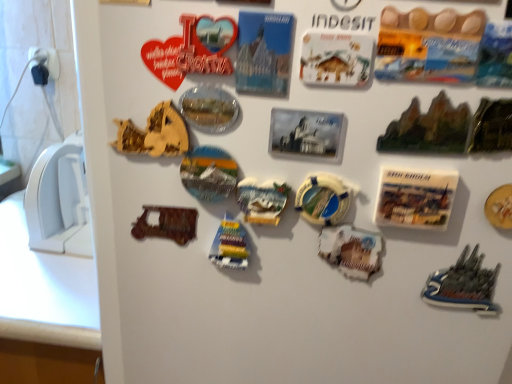
Question: Considering the positions of white paper postcard at center right and wooden toy boat at center, marked as the 2th stuff in a left-to-right arrangement, in the image, is white paper postcard at center right taller or shorter than wooden toy boat at center, marked as the 2th stuff in a left-to-right arrangement,?

Choices:
 (A) short
 (B) tall

Answer: (A)

Question: In the image, is white paper postcard at center right on the left side or the right side of wooden toy boat at center, marked as the 6th stuff in a right-to-left arrangement?

Choices:
 (A) right
 (B) left

Answer: (A)

Question: Based on their relative distances, which object is nearer to the yellow lifebuoy at center, the fourth stuff positioned from the right?

Choices:
 (A) white cardboard magnet at center, marked as the 3th stuff in a right-to-left arrangement
 (B) metallic silver magnet at center, the fifth stuff positioned from the right
 (C) white paper postcard at center right
 (D) green metallic rock at upper right, marked as the 1th stuff in a right-to-left arrangement
 (E) green glossy rock formation at upper right, the 6th stuff viewed from the left

Answer: (B)

Question: Estimate the real-world distances between objects in this image. Which object is farther from the green metallic rock at upper right, which is the seventh stuff in left-to-right order?

Choices:
 (A) green glossy rock formation at upper right, which is the 2th stuff in right-to-left order
 (B) wooden puzzle piece at upper left, which is the 7th stuff from right to left
 (C) metallic silver magnet at center, the fifth stuff positioned from the right
 (D) wooden toy boat at center, marked as the 6th stuff in a right-to-left arrangement
 (E) white paper postcard at center right

Answer: (B)